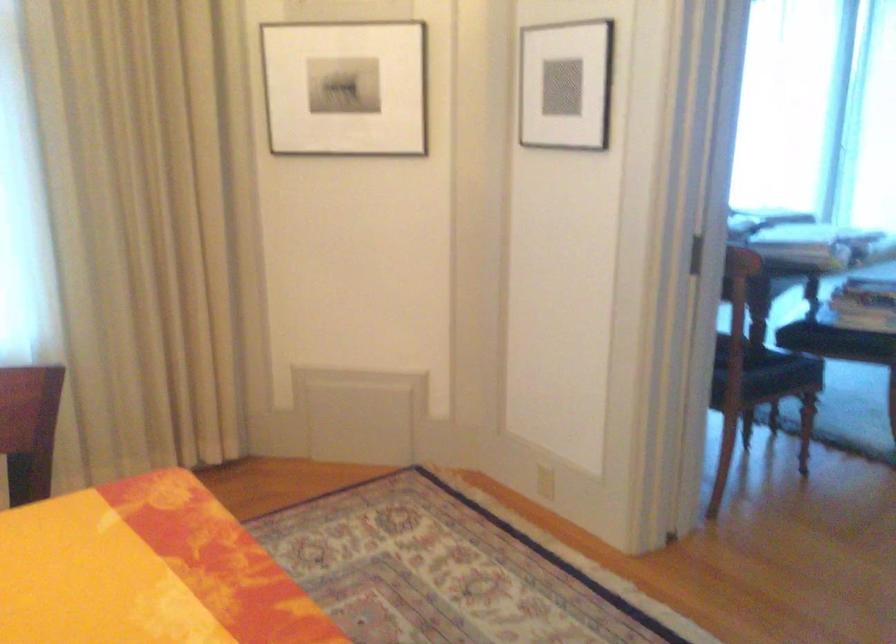
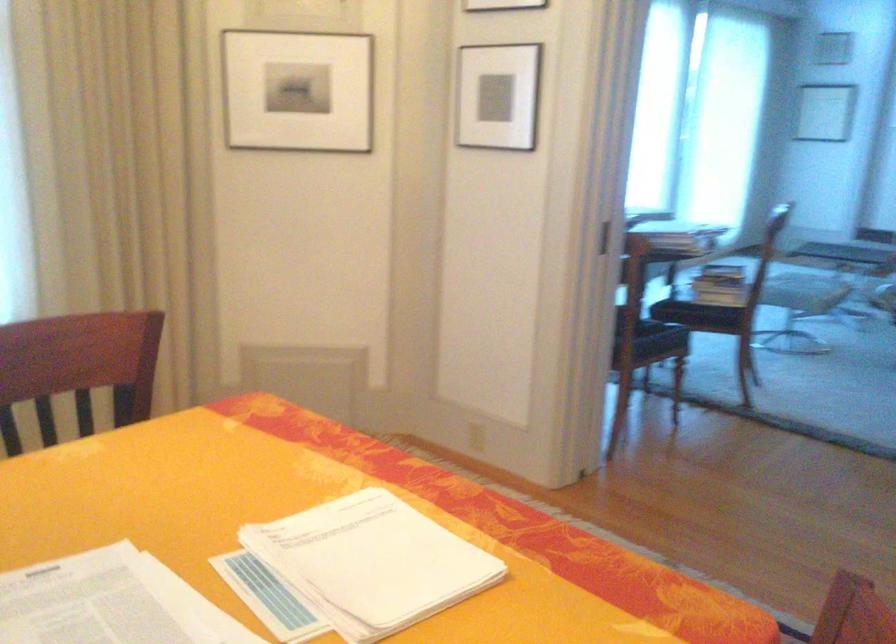
In the scene shown: The images are taken continuously from a first-person perspective. In which direction are you moving?

The movement direction of the cameraman is left, backward.